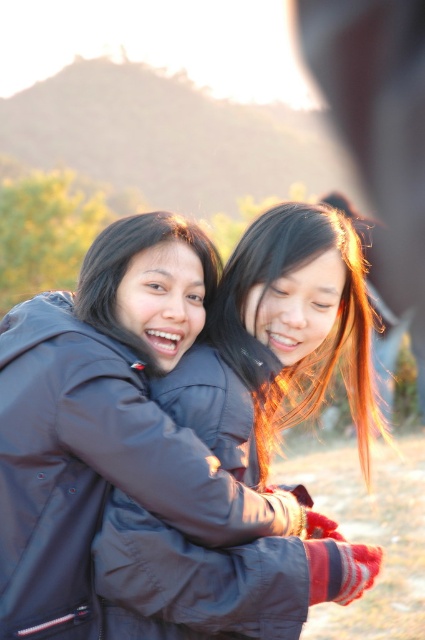
In order to click on matte black jacket at center in this screenshot , I will do `click(277, 340)`.

Where is `matte black jacket at center`? This screenshot has width=425, height=640. matte black jacket at center is located at coordinates (277, 340).